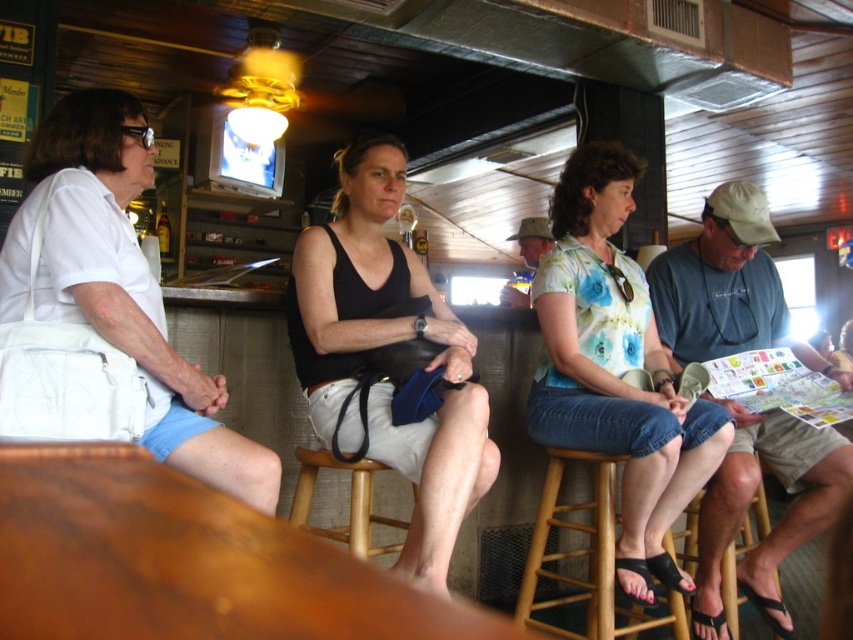
Question: Observing the image, what is the correct spatial positioning of wooden bar stool at lower center in reference to camouflage hat at center?

Choices:
 (A) above
 (B) below

Answer: (B)

Question: Based on their relative distances, which object is farther from the wooden bar stool at lower center?

Choices:
 (A) black fabric tank top at center
 (B) wooden at center
 (C) white fabric purse at left

Answer: (B)

Question: Does floral printed blouse at center appear under white fabric purse at left?

Choices:
 (A) yes
 (B) no

Answer: (A)

Question: Is black fabric tank top at center closer to the viewer compared to wooden bar stool at lower center?

Choices:
 (A) no
 (B) yes

Answer: (B)

Question: Estimate the real-world distances between objects in this image. Which object is farther from the floral printed blouse at center?

Choices:
 (A) wooden at center
 (B) white fabric purse at left
 (C) blue denim shorts at right
 (D) wooden bar stool at lower right

Answer: (B)

Question: Which is farther from the camouflage hat at center?

Choices:
 (A) wooden bar stool at lower center
 (B) wooden bar stool at lower right

Answer: (A)